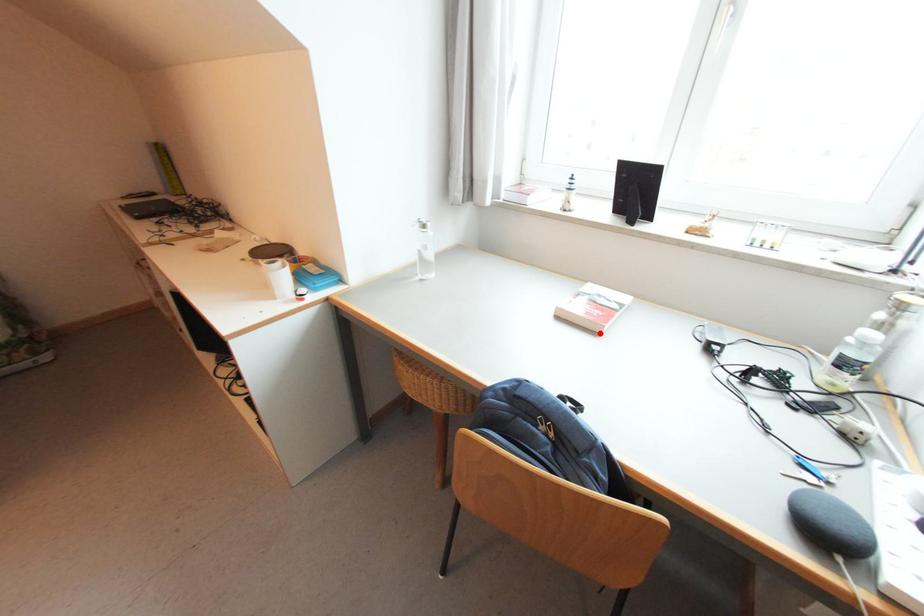
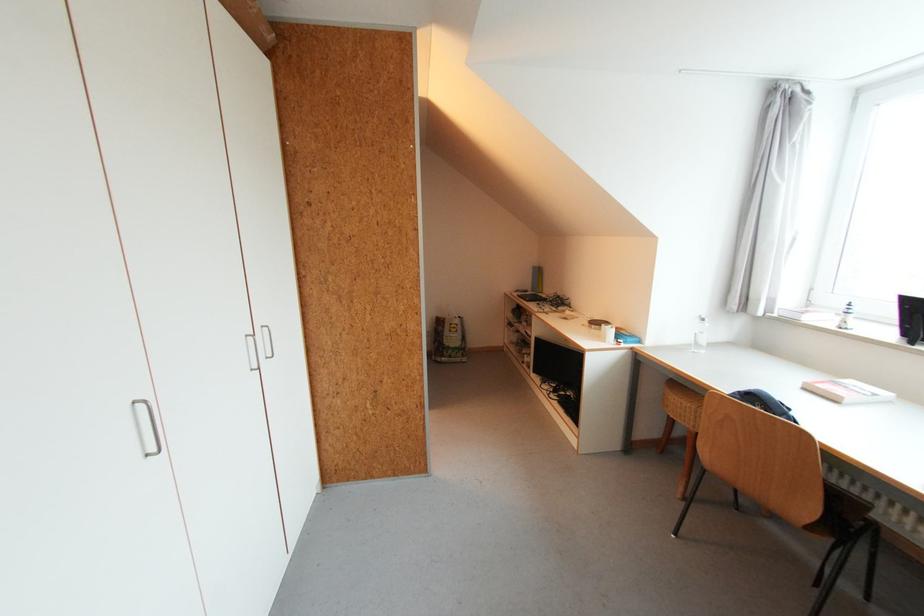
Find the pixel in the second image that matches the highlighted location in the first image.

(841, 403)